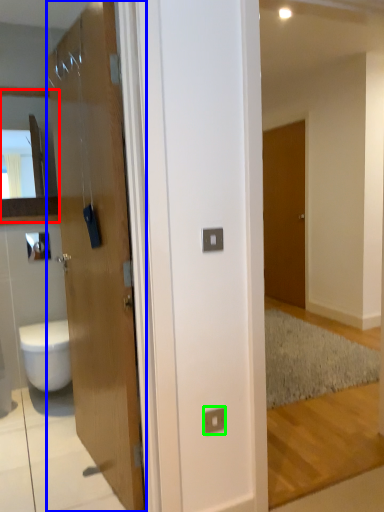
Question: Which object is positioned farthest from cabinet (highlighted by a red box)? Select from door (highlighted by a blue box) and electric outlet (highlighted by a green box).

Choices:
 (A) door
 (B) electric outlet

Answer: (B)